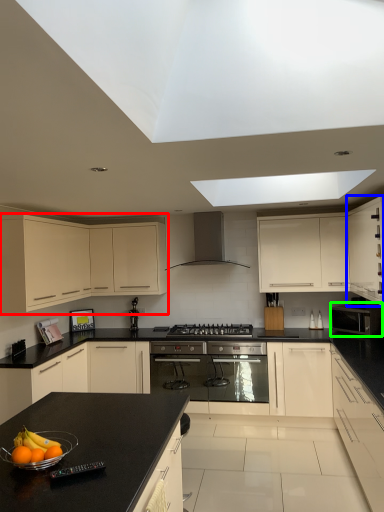
Question: Considering the real-world distances, which object is farthest from cabinetry (highlighted by a red box)? cabinetry (highlighted by a blue box) or kitchen appliance (highlighted by a green box)?

Choices:
 (A) cabinetry
 (B) kitchen appliance

Answer: (B)